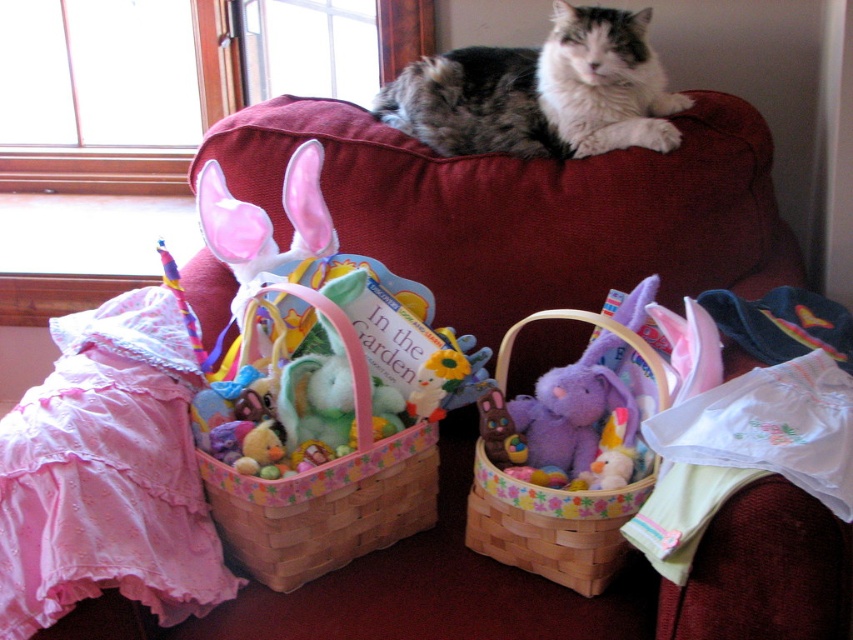
Question: Which point is closer to the camera taking this photo?

Choices:
 (A) (548, 323)
 (B) (614, 337)

Answer: (B)

Question: Which point is closer to the camera?

Choices:
 (A) (579, 65)
 (B) (747, 364)
 (C) (270, 481)
 (D) (514, 328)

Answer: (C)

Question: Does gray and white fur cat at center appear over wooden woven basket at center?

Choices:
 (A) yes
 (B) no

Answer: (A)

Question: Is gray and white fur cat at center smaller than pastel woven basket at center left?

Choices:
 (A) yes
 (B) no

Answer: (B)

Question: Does gray and white fur cat at center have a larger size compared to wooden woven basket at center?

Choices:
 (A) no
 (B) yes

Answer: (B)

Question: Among these points, which one is farthest from the camera?

Choices:
 (A) (496, 236)
 (B) (367, 364)
 (C) (549, 102)
 (D) (601, 586)

Answer: (C)